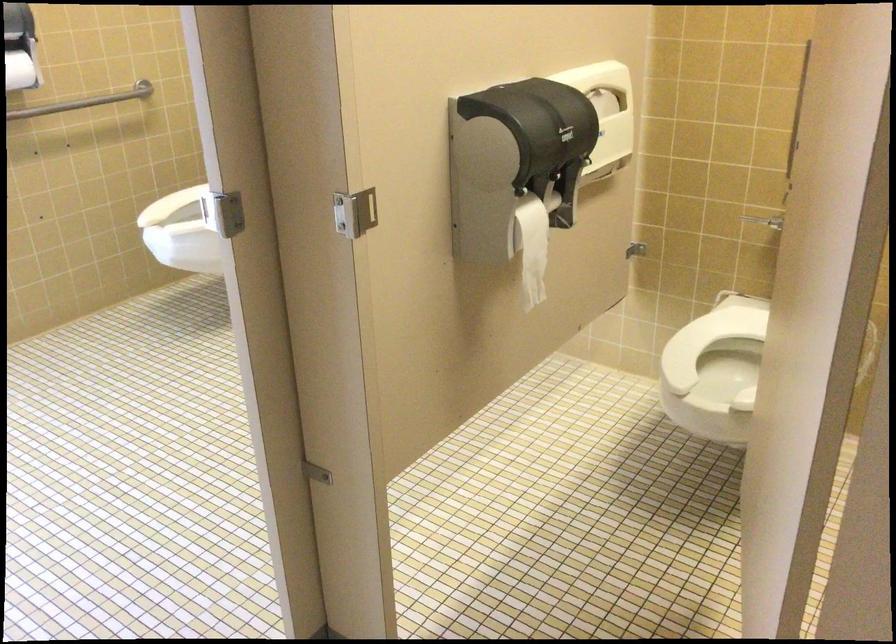
Describe the element at coordinates (711, 337) in the screenshot. I see `the white toilet seat` at that location.